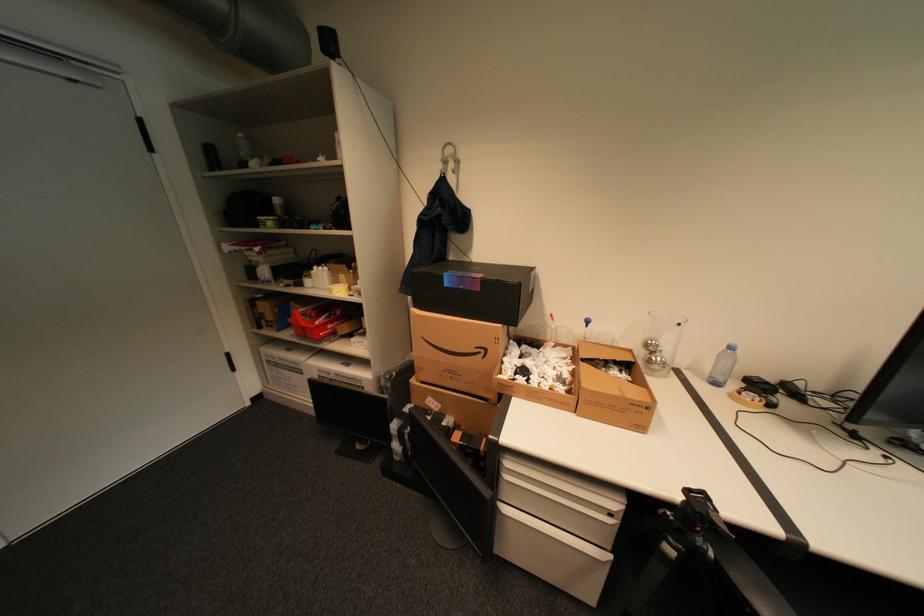
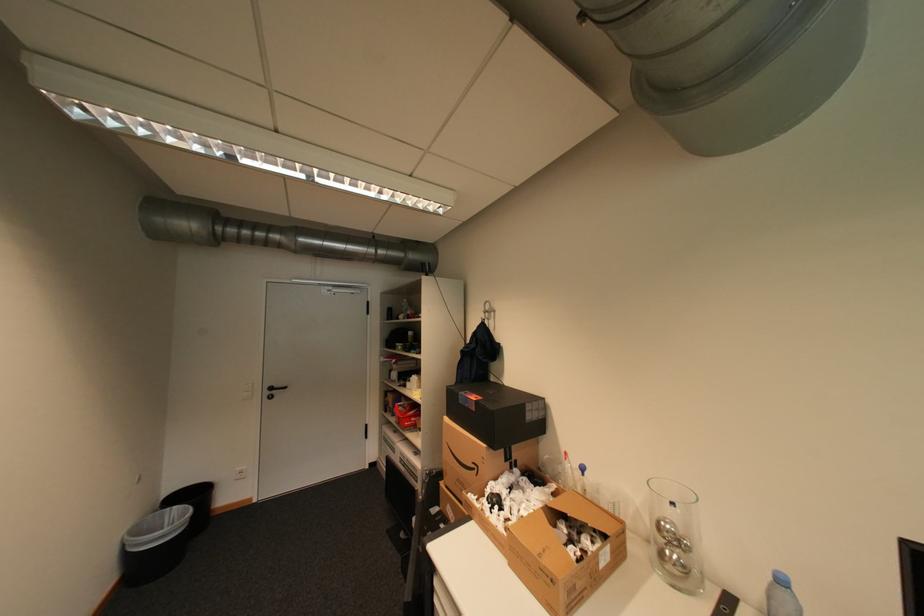
The point at (492, 352) is marked in the first image. Where is the corresponding point in the second image?

(484, 468)